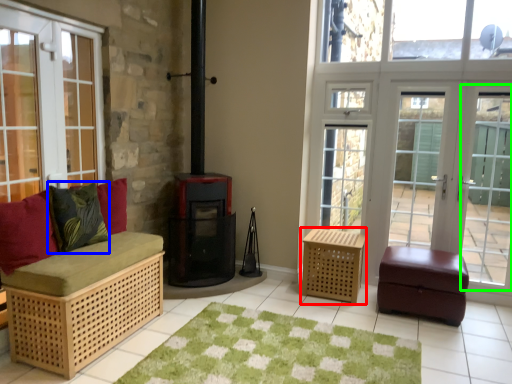
Question: Which object is positioned farthest from furniture (highlighted by a red box)? Select from pillow (highlighted by a blue box) and screen door (highlighted by a green box).

Choices:
 (A) pillow
 (B) screen door

Answer: (A)